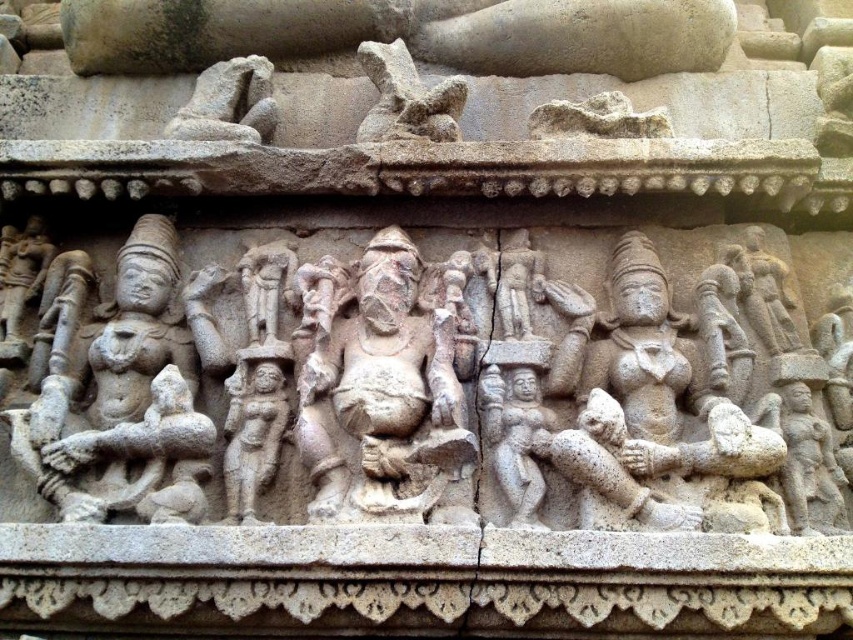
Question: Observing the image, what is the correct spatial positioning of stone carving of deities at center in reference to gray stone carving at upper center?

Choices:
 (A) left
 (B) right

Answer: (B)

Question: Which of the following is the closest to the observer?

Choices:
 (A) pyautogui.click(x=280, y=316)
 (B) pyautogui.click(x=396, y=97)

Answer: (A)

Question: Which of the following is the closest to the observer?

Choices:
 (A) (367, 445)
 (B) (422, 102)

Answer: (A)

Question: Is stone carving of deities at center thinner than gray stone carving at upper center?

Choices:
 (A) no
 (B) yes

Answer: (A)

Question: Can you confirm if stone carving of deities at center is positioned to the right of gray stone carving at upper center?

Choices:
 (A) no
 (B) yes

Answer: (B)